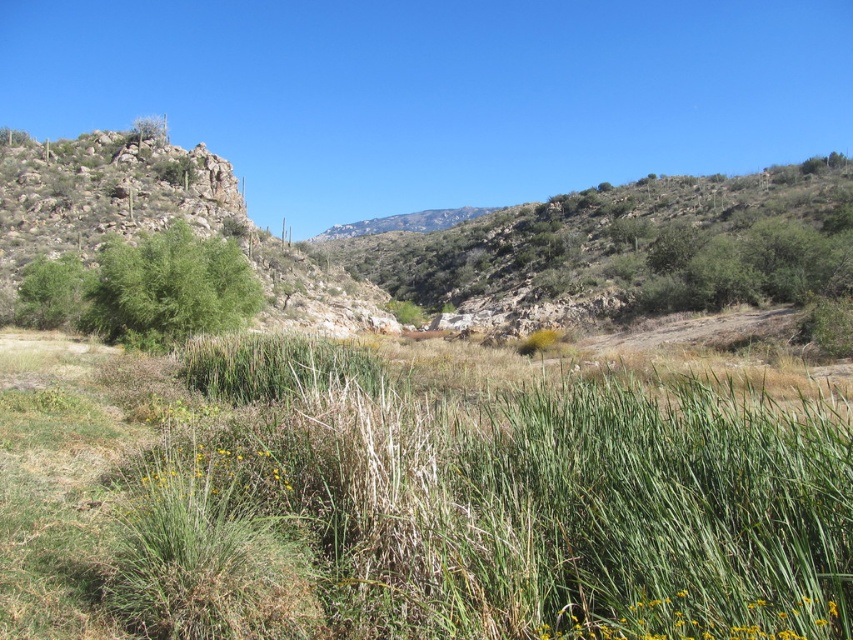
Is green grassy at center above yellow-green grass at lower right?

Yes, green grassy at center is above yellow-green grass at lower right.

Does green grassy at center have a greater height compared to yellow-green grass at lower right?

Yes.

Is point (569, 518) closer to camera compared to point (722, 630)?

No, (569, 518) is behind (722, 630).

This screenshot has height=640, width=853. What are the coordinates of `green grassy at center` in the screenshot? It's located at (451, 515).

The width and height of the screenshot is (853, 640). I want to click on green leafy bush at left, so click(x=144, y=289).

Which is behind, point (218, 291) or point (773, 636)?

The point (218, 291) is more distant.

Is point (50, 268) farther from viewer compared to point (633, 621)?

Yes, point (50, 268) is behind point (633, 621).

This screenshot has height=640, width=853. What are the coordinates of `green leafy bush at left` in the screenshot? It's located at (144, 289).

Does green grassy at center have a larger size compared to green leafy bush at left?

Actually, green grassy at center might be smaller than green leafy bush at left.

Is green grassy at center to the right of green leafy bush at left from the viewer's perspective?

Correct, you'll find green grassy at center to the right of green leafy bush at left.

You are a GUI agent. You are given a task and a screenshot of the screen. Output one action in this format:
    pyautogui.click(x=<x>, y=<y>)
    Task: Click on the green grassy at center
    
    Given the screenshot: What is the action you would take?
    pyautogui.click(x=451, y=515)

Find the location of `green grassy at center`. green grassy at center is located at coordinates (451, 515).